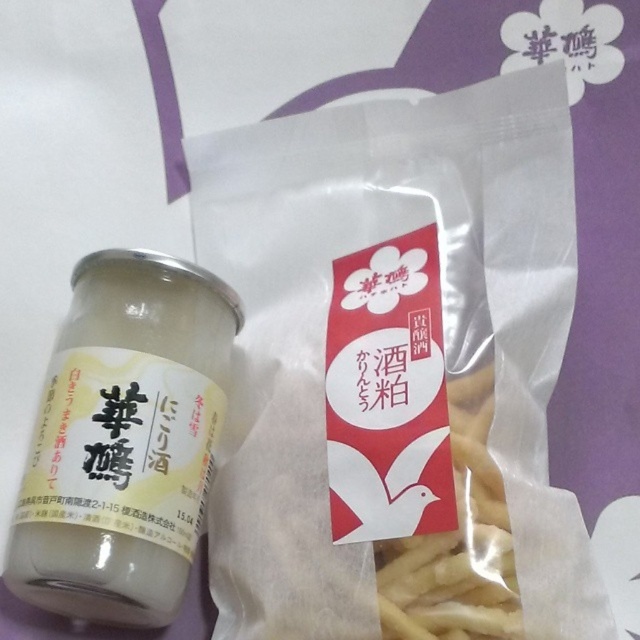
Does translucent glass jar at center appear over yellow matte french fries at center?

A: Yes, translucent glass jar at center is above yellow matte french fries at center.

The image size is (640, 640). Identify the location of translucent glass jar at center. (124, 440).